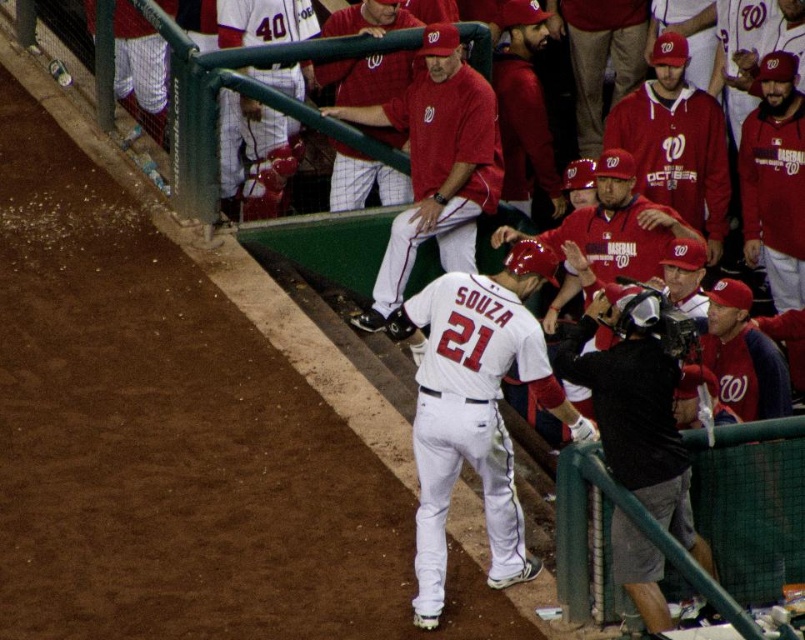
Locate an element on the screen. Image resolution: width=805 pixels, height=640 pixels. matte red shirt at center is located at coordinates (436, 164).

Is matte red shirt at center further to the viewer compared to matte red cap at upper center?

No, matte red shirt at center is in front of matte red cap at upper center.

Image resolution: width=805 pixels, height=640 pixels. Find the location of `matte red shirt at center`. matte red shirt at center is located at coordinates (436, 164).

In the scene shown: Does black fabric camera at center appear under matte red baseball cap at center?

Yes.

Is black fabric camera at center further to the viewer compared to matte red baseball cap at center?

Answer: No.

This screenshot has width=805, height=640. Identify the location of black fabric camera at center. (636, 406).

The image size is (805, 640). In order to click on black fabric camera at center in this screenshot , I will do click(x=636, y=406).

Does point (609, 349) come closer to viewer compared to point (217, 8)?

That is True.

Who is taller, black fabric camera at center or white jersey at upper center?

With more height is black fabric camera at center.

Is point (595, 317) positioned behind point (240, 176)?

No.

Where is `black fabric camera at center`? This screenshot has width=805, height=640. black fabric camera at center is located at coordinates (636, 406).